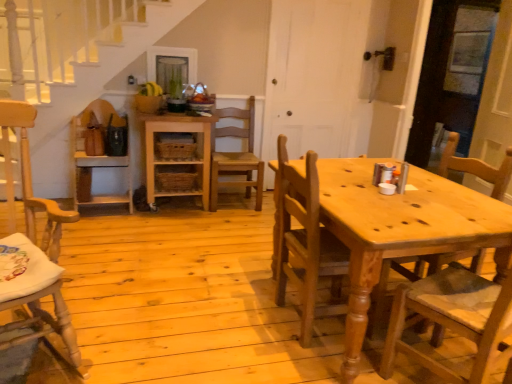
Question: Considering the positions of light brown wood chair at left, marked as the 2th chair in a left-to-right arrangement, and natural wood chair at center, which appears as the second chair when viewed from the right, in the image, is light brown wood chair at left, marked as the 2th chair in a left-to-right arrangement, bigger or smaller than natural wood chair at center, which appears as the second chair when viewed from the right,?

Choices:
 (A) big
 (B) small

Answer: (A)

Question: In the image, is light brown wood chair at left, marked as the 2th chair in a left-to-right arrangement, on the left side or the right side of natural wood chair at center, which appears as the second chair when viewed from the right?

Choices:
 (A) left
 (B) right

Answer: (A)

Question: Based on their relative distances, which object is nearer to the wooden chair at right, acting as the fifth chair starting from the left?

Choices:
 (A) natural wood shelf at center
 (B) natural wood chair at center, which appears as the second chair when viewed from the right
 (C) wooden chair at center, which is counted as the 5th chair, starting from the right
 (D) light brown wood chair at left, which is counted as the fourth chair, starting from the right
 (E) wooden chair at center, arranged as the 3th chair when viewed from the left

Answer: (B)

Question: Estimate the real-world distances between objects in this image. Which object is closer to the wooden chair at right, acting as the fifth chair starting from the left?

Choices:
 (A) natural wood chair at center, the 4th chair from the left
 (B) wooden chair at center, the first chair positioned from the left
 (C) natural wood shelf at center
 (D) light brown wood chair at left, which is counted as the fourth chair, starting from the right
 (E) wooden chair at center, the 3th chair viewed from the right

Answer: (A)